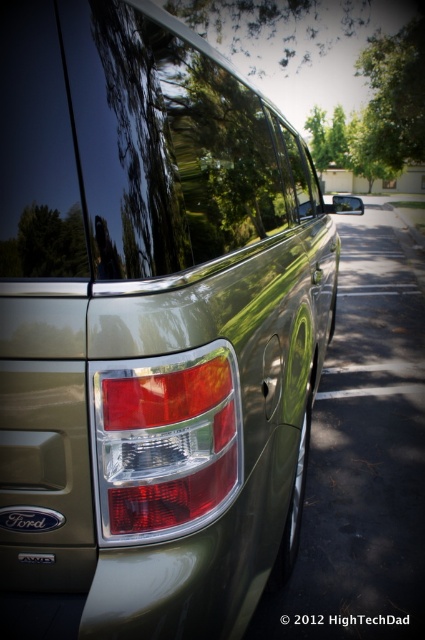
Can you confirm if matte plastic tail light at center is shorter than black plastic license plate at lower center?

Incorrect, matte plastic tail light at center's height does not fall short of black plastic license plate at lower center's.

Can you confirm if matte plastic tail light at center is smaller than black plastic license plate at lower center?

Actually, matte plastic tail light at center might be larger than black plastic license plate at lower center.

Does point (119, 416) come in front of point (45, 556)?

Yes.

Image resolution: width=425 pixels, height=640 pixels. What are the coordinates of `matte plastic tail light at center` in the screenshot? It's located at (164, 442).

Between green leafy tree at upper center and black plastic license plate at lower center, which one is positioned higher?

green leafy tree at upper center

Is point (334, 156) more distant than point (37, 557)?

That is True.

This screenshot has width=425, height=640. Identify the location of green leafy tree at upper center. (379, 109).

Who is positioned more to the left, glossy metallic car window at center or black plastic license plate at lower center?

From the viewer's perspective, black plastic license plate at lower center appears more on the left side.

Between point (193, 218) and point (42, 557), which one is positioned in front?

Point (42, 557) is in front.

Where is `glossy metallic car window at center`? The image size is (425, 640). glossy metallic car window at center is located at coordinates (172, 147).